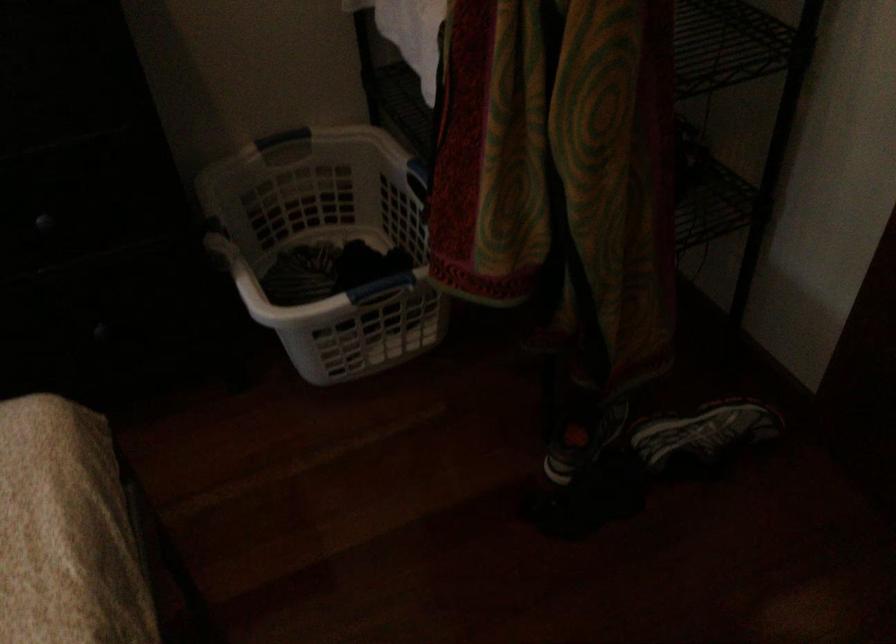
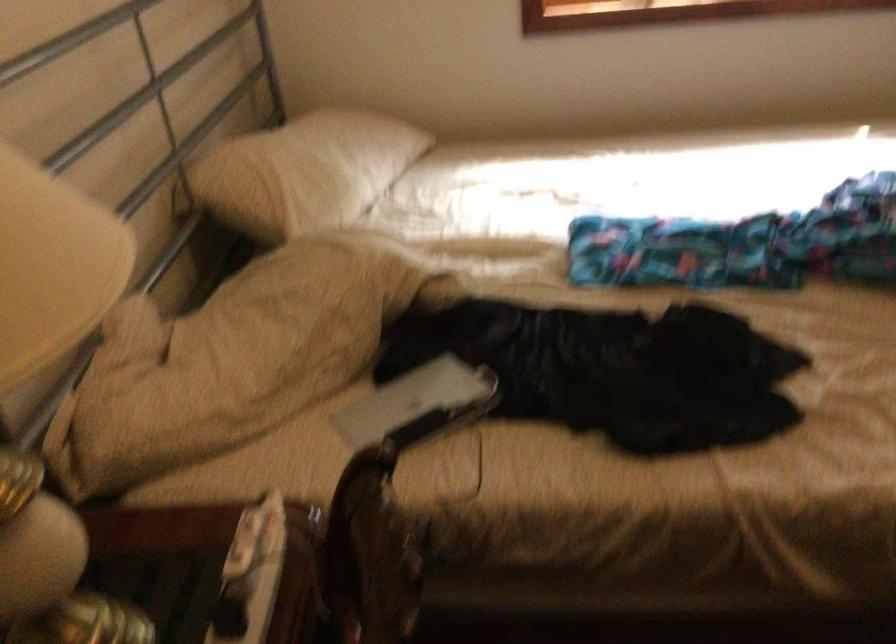
First-person continuous shooting, in which direction is the camera rotating?

The rotation direction of the camera is left-down.